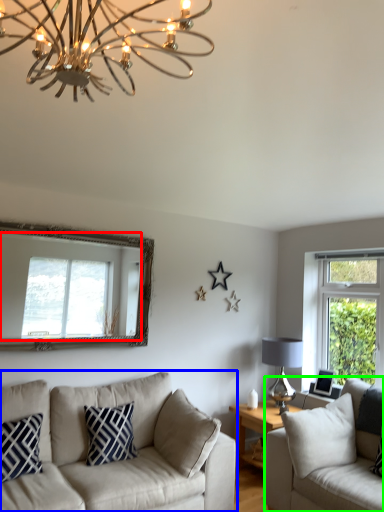
Question: Which is nearer to the window (highlighted by a red box)? studio couch (highlighted by a blue box) or studio couch (highlighted by a green box).

Choices:
 (A) studio couch
 (B) studio couch

Answer: (A)